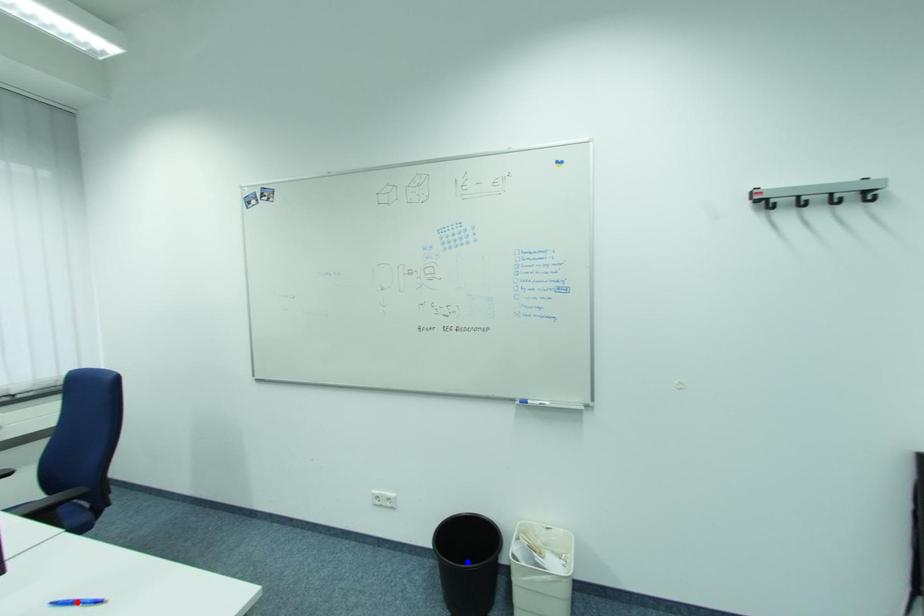
Question: Which of the two points in the image is closer to the camera?

Choices:
 (A) Blue point is closer.
 (B) Red point is closer.

Answer: (B)